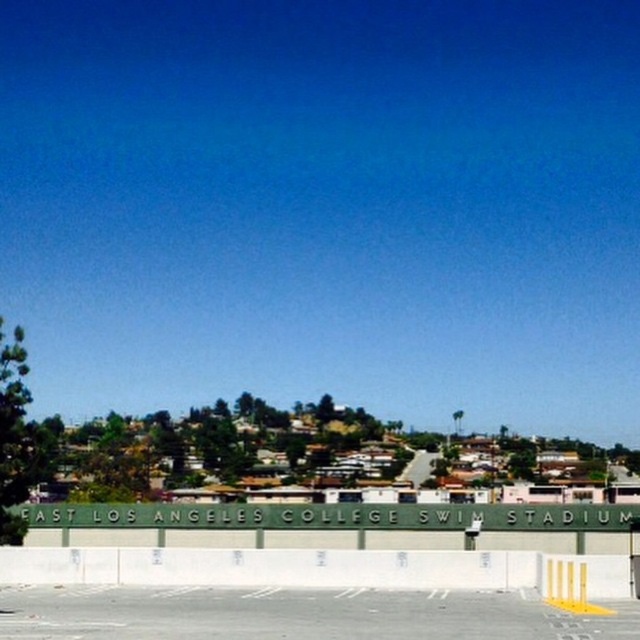
You are a delivery driver who needs to park your vehicle in the gray asphalt parking lot at lower center. However, there is a white concrete barrier at lower center blocking the entrance. Can you drive around the barrier to access the parking lot?

The gray asphalt parking lot at lower center has a larger size compared to the white concrete barrier at lower center. Since the parking lot is bigger, there might be space to maneuver around the barrier. However, the barrier itself is at the entrance, so you would need to go around it either to the left or right side if there is an opening. Without additional information about the barrier layout, it is uncertain if there is a clear path around it.

You are a delivery driver who needs to park your 2.5 meter wide truck in the gray asphalt parking lot at lower center. The parking space is adjacent to the white concrete barrier at lower center. Can your truck fit in the parking space without touching the barrier?

The gray asphalt parking lot at lower center has a width less than the white concrete barrier at lower center. Since the parking space is adjacent to the barrier, the truck may not fit as the parking space is narrower than the barrier itself. However, without knowing the exact width of the parking space, it is uncertain. Please check the actual dimensions before proceeding.

From the picture: You are driving a car that is 5 meters long. You need to park your car between the gray asphalt parking lot at lower center and the white concrete barrier at lower center. Is there enough space for your car to fit between them?

The gray asphalt parking lot at lower center is 7.55 meters from the white concrete barrier at lower center. Since your car is 5 meters long, there is enough space to park between them as the distance between the two objects is greater than the car length.